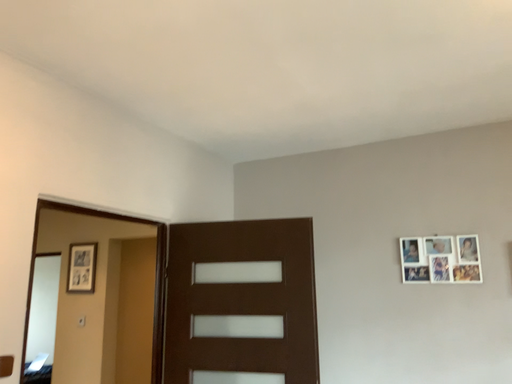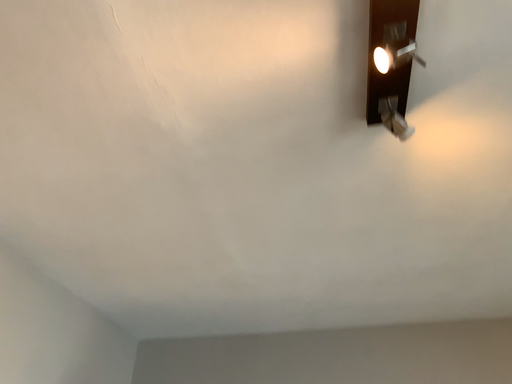
Question: Which way did the camera rotate in the video?

Choices:
 (A) rotated downward
 (B) rotated upward

Answer: (B)